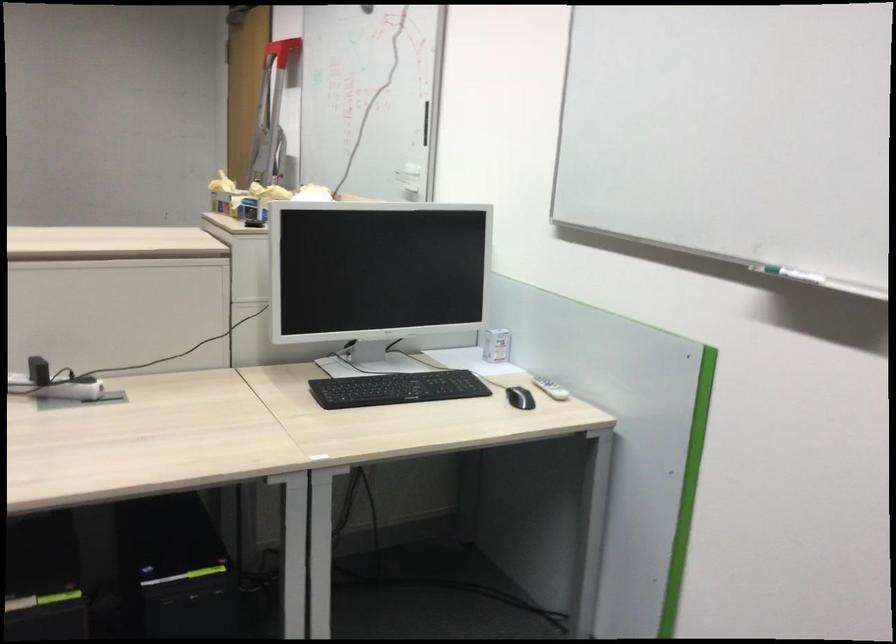
You are a GUI agent. You are given a task and a screenshot of the screen. Output one action in this format:
    pyautogui.click(x=<x>, y=<y>)
    Task: Click on the black computer mouse
    
    Given the screenshot: What is the action you would take?
    pyautogui.click(x=520, y=398)